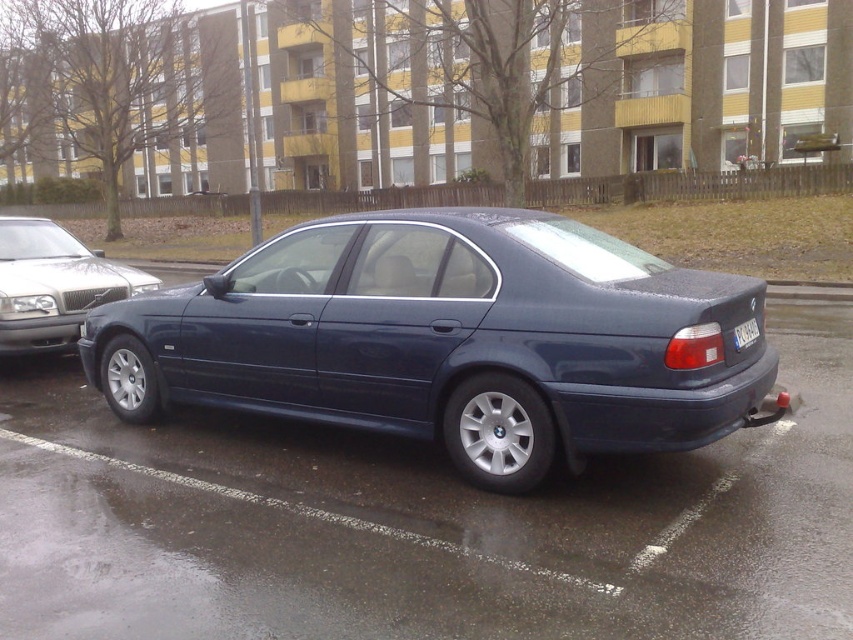
Who is lower down, glossy metallic car at center or satin dark blue sedan at center?

glossy metallic car at center is below.

Identify the location of glossy metallic car at center. Image resolution: width=853 pixels, height=640 pixels. (421, 525).

From the picture: Can you confirm if satin dark blue sedan at center is thinner than satin dark blue sedan at left?

Yes.

Measure the distance between satin dark blue sedan at center and satin dark blue sedan at left.

satin dark blue sedan at center is 25.13 feet from satin dark blue sedan at left.

I want to click on satin dark blue sedan at center, so click(x=451, y=339).

Does satin dark blue sedan at left come in front of black plastic license plate at rear?

No, it is behind black plastic license plate at rear.

Can you confirm if satin dark blue sedan at left is positioned above black plastic license plate at rear?

Correct, satin dark blue sedan at left is located above black plastic license plate at rear.

You are a GUI agent. You are given a task and a screenshot of the screen. Output one action in this format:
    pyautogui.click(x=<x>, y=<y>)
    Task: Click on the satin dark blue sedan at left
    This screenshot has width=853, height=640.
    Given the screenshot: What is the action you would take?
    [x=53, y=284]

Where is `satin dark blue sedan at left`? The height and width of the screenshot is (640, 853). satin dark blue sedan at left is located at coordinates (53, 284).